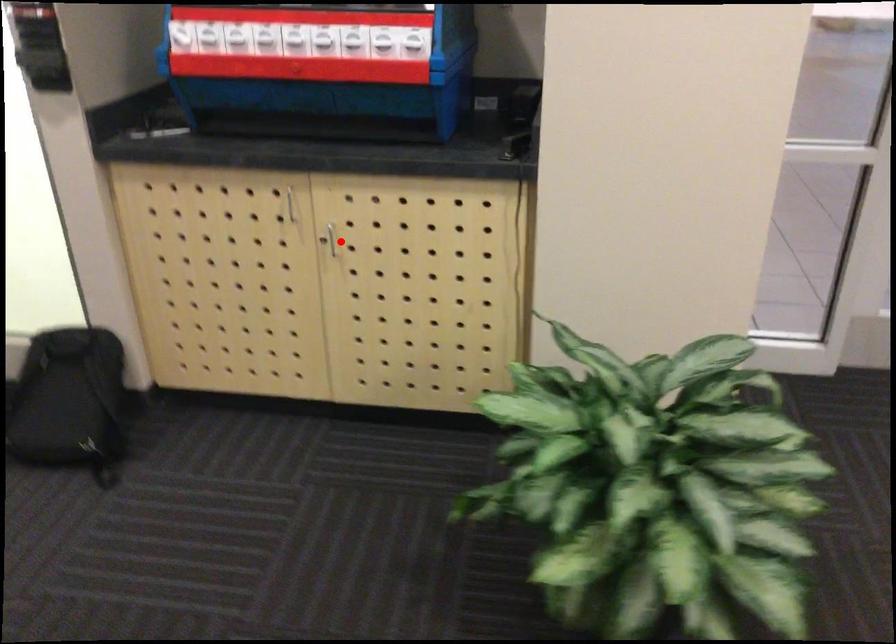
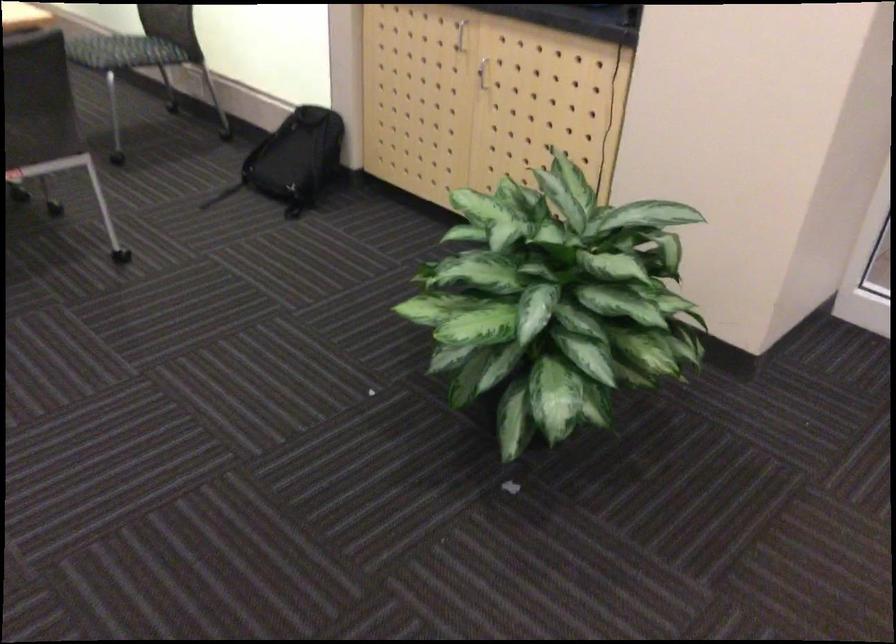
Question: A red point is marked in image1. In image2, is the corresponding 3D point closer to the camera or farther? Reply with the corresponding letter.

Choices:
 (A) The corresponding 3D point is closer.
 (B) The corresponding 3D point is farther.

Answer: (B)